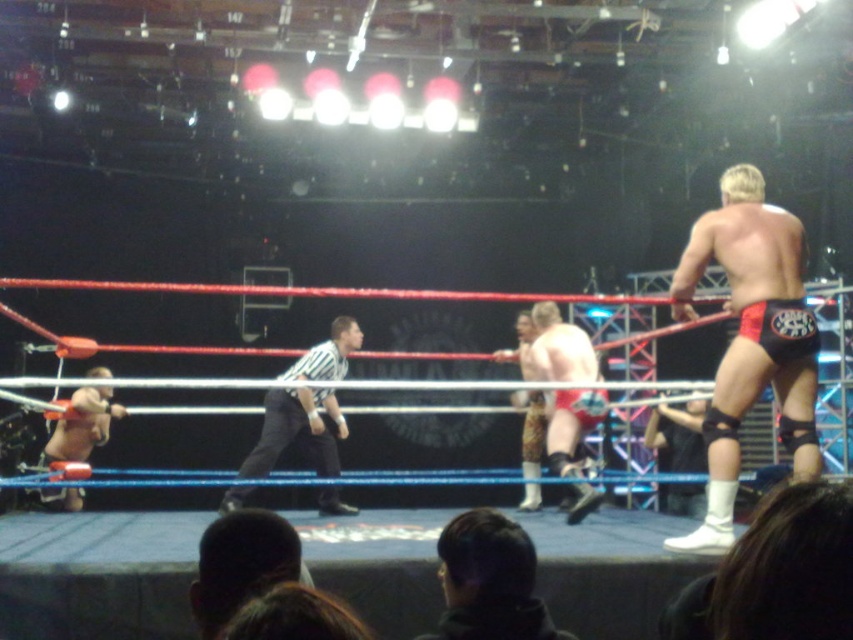
Who is more distant from viewer, (506, 536) or (332, 493)?

The point (332, 493) is more distant.

Is black leather jacket at lower center thinner than striped fabric referee at center?

Yes, black leather jacket at lower center is thinner than striped fabric referee at center.

Is point (543, 618) less distant than point (299, 369)?

Yes, point (543, 618) is closer to viewer.

Where is `black leather jacket at lower center`? This screenshot has width=853, height=640. black leather jacket at lower center is located at coordinates (489, 580).

Which is in front, point (508, 564) or point (91, 412)?

Point (508, 564) is in front.

Who is more distant from viewer, (502, 540) or (74, 500)?

Point (74, 500)

Does point (451, 545) come closer to viewer compared to point (117, 406)?

Yes, point (451, 545) is closer to viewer.

Where is `black leather jacket at lower center`? This screenshot has height=640, width=853. black leather jacket at lower center is located at coordinates (489, 580).

Which is more to the left, black leather jacket at lower center or camouflage-patterned shorts at center?

Positioned to the left is black leather jacket at lower center.

Is point (477, 557) more distant than point (543, 326)?

No, it is not.

Where is `black leather jacket at lower center`? black leather jacket at lower center is located at coordinates (489, 580).